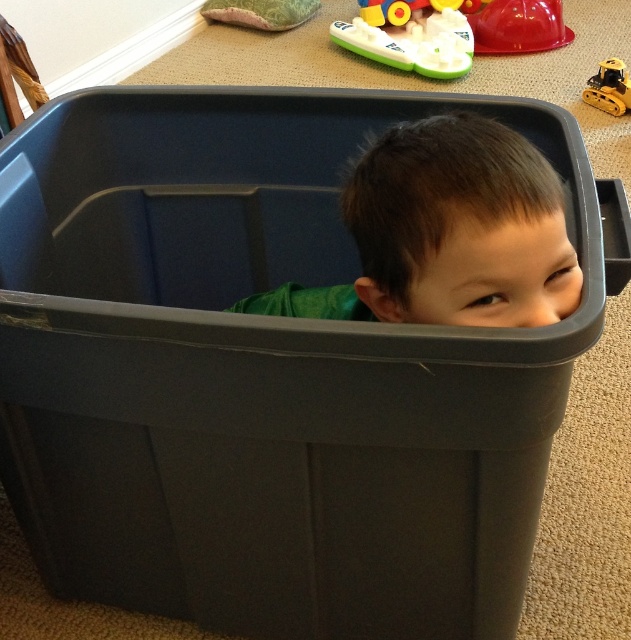
This screenshot has height=640, width=631. Describe the element at coordinates (519, 26) in the screenshot. I see `shiny plastic bowl at upper right` at that location.

Is shiny plastic bowl at upper right taller than yellow rubber toy at upper center?

Yes, shiny plastic bowl at upper right is taller than yellow rubber toy at upper center.

Which is in front, point (492, 44) or point (599, 97)?

Point (599, 97) is in front.

In order to click on shiny plastic bowl at upper right in this screenshot , I will do `click(519, 26)`.

Is green plastic boat at upper center bigger than shiny plastic bowl at upper right?

Indeed, green plastic boat at upper center has a larger size compared to shiny plastic bowl at upper right.

From the picture: Does green plastic boat at upper center appear on the left side of shiny plastic bowl at upper right?

Indeed, green plastic boat at upper center is positioned on the left side of shiny plastic bowl at upper right.

Looking at this image, who is more forward, [351,44] or [546,13]?

Positioned in front is point [351,44].

This screenshot has height=640, width=631. In order to click on green plastic boat at upper center in this screenshot , I will do `click(410, 40)`.

Does yellow plastic toy at upper center appear over yellow rubber toy at upper center?

Yes.

Does yellow plastic toy at upper center have a lesser width compared to yellow rubber toy at upper center?

No.

Does point (406, 12) come in front of point (625, 72)?

No, it is not.

Identify the location of yellow plastic toy at upper center. (410, 10).